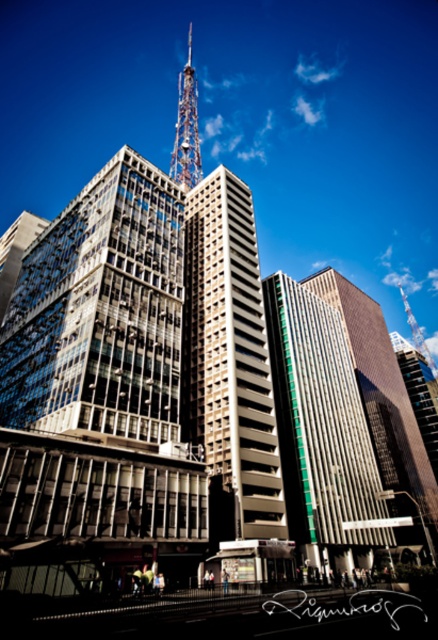
You are a drone operator trying to navigate between two points in the city. You see a point at coordinate (281,353) and another at (177,180). Which point is nearer to your current position?

Point (281,353) is closer to the viewer than point (177,180), so the point at coordinate (281,353) is nearer to your current position.

You are a drone operator planning to fly a drone from the metallic glass skyscraper at center to the metallic lattice tower at upper center. The drone has a maximum flight range of 60 meters. Can the drone reach the tower without needing to recharge?

The metallic glass skyscraper at center is 59.34 meters away from the metallic lattice tower at upper center. Since the drone can fly up to 60 meters, it can reach the tower without needing to recharge.

You are standing in the urban scene looking at the point marked at coordinates (370, 557). If you want to reach that point, which direction should you move relative to your current position?

The point at coordinates (370, 557) is 82.07 meters away from the viewer, so you should move towards it in the direction it is located to reach it.